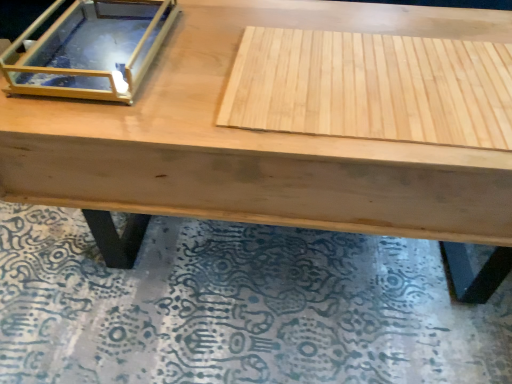
Locate an element on the screen. This screenshot has width=512, height=384. free spot below clear glass box at upper left (from a real-world perspective) is located at coordinates [x=96, y=47].